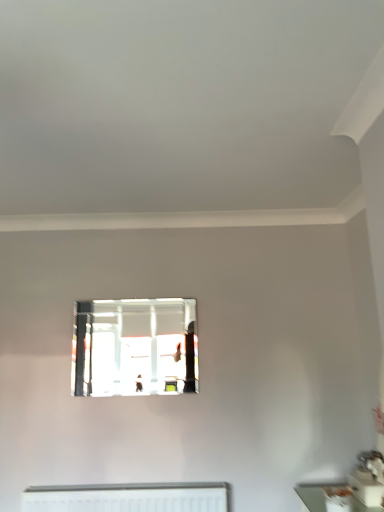
This screenshot has height=512, width=384. What do you see at coordinates (134, 347) in the screenshot? I see `clear glass window at center` at bounding box center [134, 347].

In order to face clear glass window at center, should I rotate leftwards or rightwards?

Turn left by 7.686 degrees to look at clear glass window at center.

Locate an element on the screen. Image resolution: width=384 pixels, height=512 pixels. clear glass window at center is located at coordinates (134, 347).

Locate an element on the screen. The height and width of the screenshot is (512, 384). clear glass window at center is located at coordinates (134, 347).